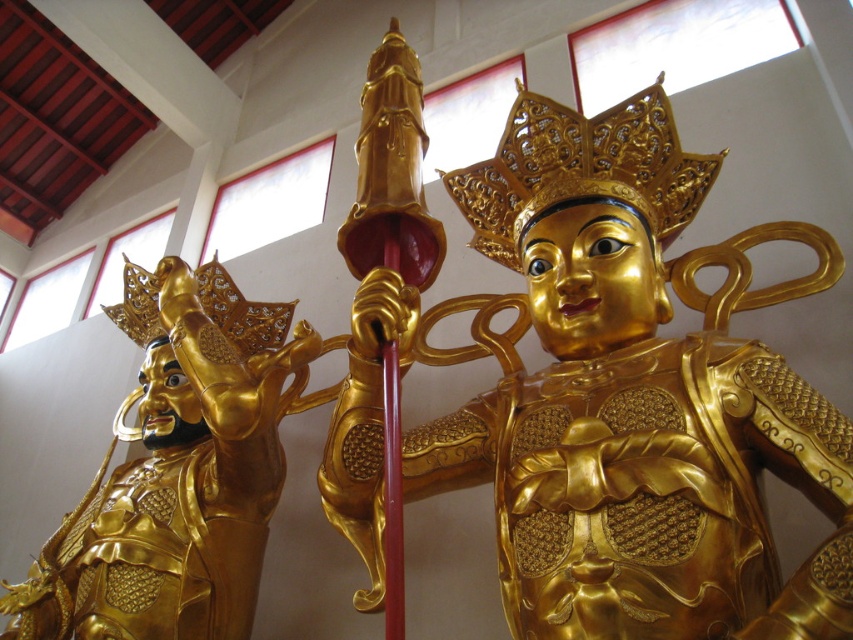
Question: Can you confirm if gold polished statue at center is positioned to the left of gold polished armor at left?

Choices:
 (A) yes
 (B) no

Answer: (B)

Question: Which point appears closest to the camera in this image?

Choices:
 (A) (505, 150)
 (B) (221, 381)

Answer: (B)

Question: Does gold polished statue at center have a smaller size compared to gold polished armor at left?

Choices:
 (A) no
 (B) yes

Answer: (B)

Question: Does gold polished statue at center have a smaller size compared to gold polished armor at left?

Choices:
 (A) yes
 (B) no

Answer: (A)

Question: Among these objects, which one is farthest from the camera?

Choices:
 (A) gold polished statue at center
 (B) gold polished armor at left

Answer: (B)

Question: Among these objects, which one is nearest to the camera?

Choices:
 (A) gold polished armor at left
 (B) gold polished statue at center

Answer: (B)